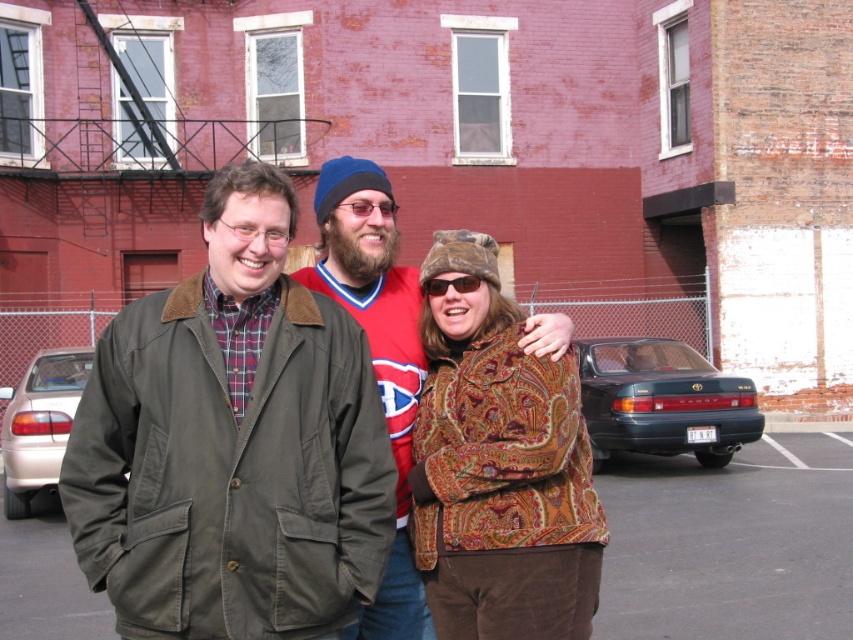
Question: Among these points, which one is farthest from the camera?

Choices:
 (A) (463, 276)
 (B) (653, 346)
 (C) (485, 275)
 (D) (776, 474)

Answer: (B)

Question: Observing the image, what is the correct spatial positioning of paisley-patterned jacket at center in reference to gold metallic car at lower left?

Choices:
 (A) below
 (B) above

Answer: (B)

Question: Among these objects, which one is farthest from the camera?

Choices:
 (A) paisley-patterned jacket at center
 (B) black plastic sunglasses at center
 (C) brown textured coat at center
 (D) gold metallic car at lower left

Answer: (D)

Question: Does dark gray asphalt at lower center appear on the left side of black plastic sunglasses at center?

Choices:
 (A) no
 (B) yes

Answer: (A)

Question: Does brown textured coat at center appear over dark gray asphalt at lower center?

Choices:
 (A) yes
 (B) no

Answer: (A)

Question: Among these points, which one is farthest from the camera?

Choices:
 (A) (520, 353)
 (B) (828, 522)
 (C) (166, 429)
 (D) (430, 278)

Answer: (B)